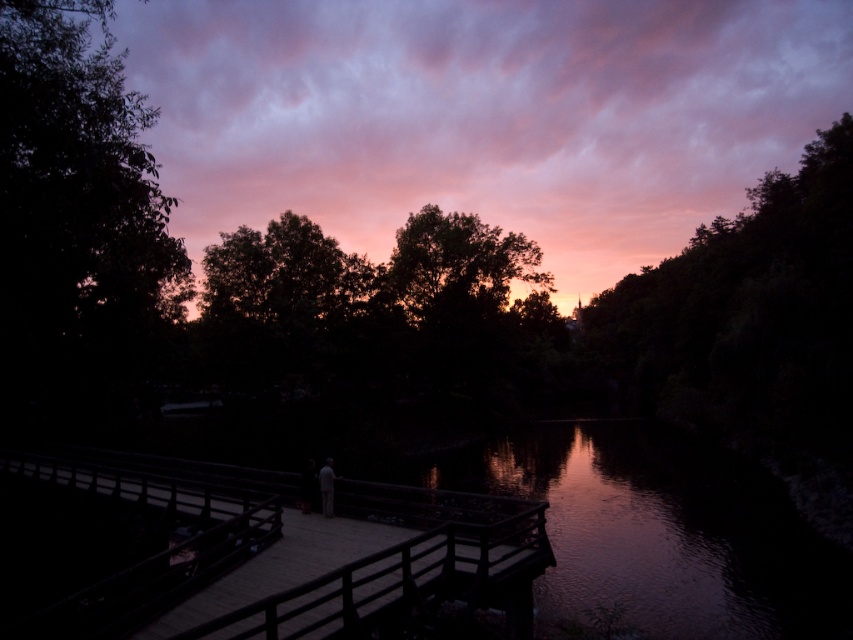
Question: Which point is farther to the camera?

Choices:
 (A) (42, 76)
 (B) (751, 513)
 (C) (323, 486)

Answer: (B)

Question: Considering the relative positions of wooden dock at center and light gray fabric person at center in the image provided, where is wooden dock at center located with respect to light gray fabric person at center?

Choices:
 (A) below
 (B) above

Answer: (B)

Question: Which object is the farthest from the glossy water at center?

Choices:
 (A) light gray fabric person at center
 (B) dark green leafy tree at left
 (C) wooden dock at center

Answer: (B)

Question: Is wooden dock at center further to the viewer compared to light gray fabric person at center?

Choices:
 (A) yes
 (B) no

Answer: (B)

Question: Considering the relative positions of dark green leafy tree at left and glossy water at center in the image provided, where is dark green leafy tree at left located with respect to glossy water at center?

Choices:
 (A) above
 (B) below

Answer: (A)

Question: Which is farther from the glossy water at center?

Choices:
 (A) wooden dock at center
 (B) light gray fabric person at center

Answer: (B)